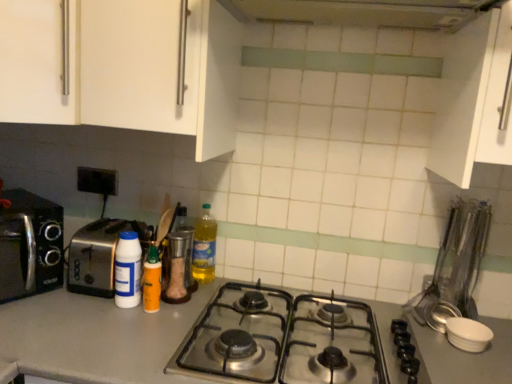
Locate an element on the screen. This screenshot has width=512, height=384. free point to the right of white matte bottle at center-left, marked as the fourth bottle in a right-to-left arrangement is located at coordinates (175, 310).